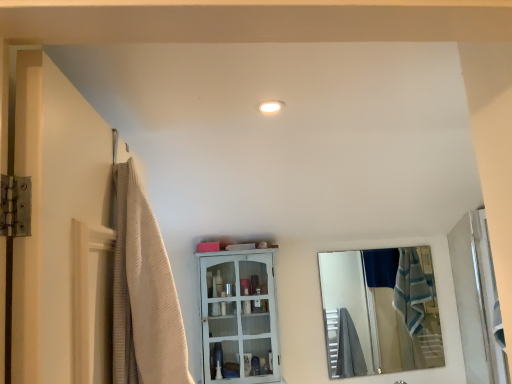
Question: Can you confirm if silver reflective mirror at right is thinner than white glossy door at right?

Choices:
 (A) yes
 (B) no

Answer: (A)

Question: Are silver reflective mirror at right and white glossy door at right located far from each other?

Choices:
 (A) no
 (B) yes

Answer: (B)

Question: Is white glossy door at right a part of silver reflective mirror at right?

Choices:
 (A) no
 (B) yes

Answer: (A)

Question: Considering the relative sizes of silver reflective mirror at right and white glossy door at right in the image provided, is silver reflective mirror at right smaller than white glossy door at right?

Choices:
 (A) no
 (B) yes

Answer: (B)

Question: Is silver reflective mirror at right wider than white glossy door at right?

Choices:
 (A) yes
 (B) no

Answer: (B)

Question: Does silver reflective mirror at right have a lesser height compared to white glossy door at right?

Choices:
 (A) no
 (B) yes

Answer: (A)

Question: Does beige textured shower curtain at left have a lesser height compared to white glossy door at right?

Choices:
 (A) yes
 (B) no

Answer: (A)

Question: Could white glossy door at right be considered to be inside beige textured shower curtain at left?

Choices:
 (A) yes
 (B) no

Answer: (B)

Question: From the image's perspective, is beige textured shower curtain at left on top of white glossy door at right?

Choices:
 (A) yes
 (B) no

Answer: (A)

Question: Can you confirm if beige textured shower curtain at left is thinner than white glossy door at right?

Choices:
 (A) no
 (B) yes

Answer: (B)

Question: Can you confirm if beige textured shower curtain at left is smaller than white glossy door at right?

Choices:
 (A) yes
 (B) no

Answer: (B)

Question: Is beige textured shower curtain at left aimed at white glossy door at right?

Choices:
 (A) yes
 (B) no

Answer: (B)

Question: Is beige textured shower curtain at left surrounding white glossy light fixture at upper center?

Choices:
 (A) no
 (B) yes

Answer: (A)